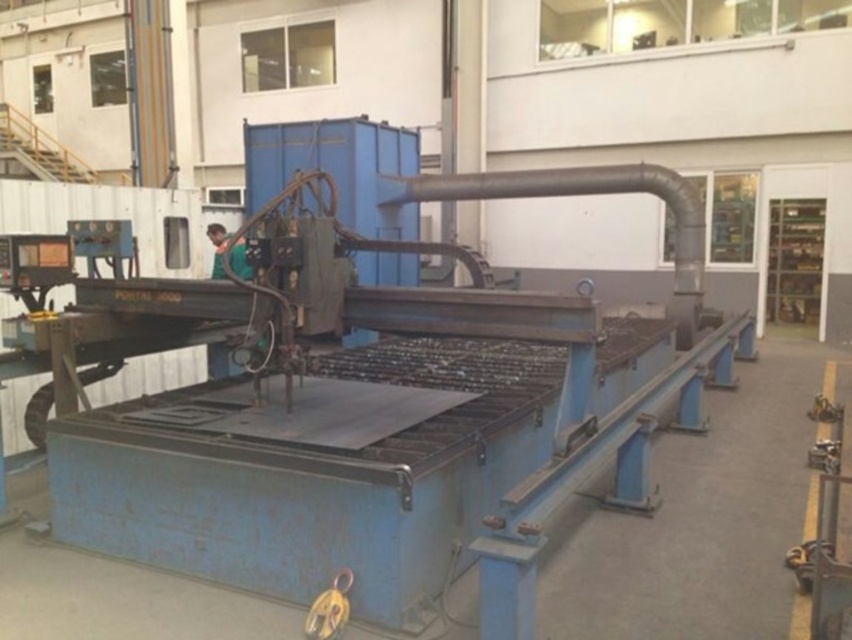
You are an inspector standing at the front of the CNC plasma cutter machine. You notice two points marked on the machine. Which of the two points, point (321, 608) or point (220, 260), is closer to your current position?

Point (321, 608) is closer to the camera than point (220, 260), so the point closer to your current position is point (321, 608).

You are an employee in the workshop and need to hang the green fabric shirt at center on the yellow metallic hook at lower center. Can you do this without needing a stool?

The yellow metallic hook at lower center has a lesser height compared to green fabric shirt at center, which means the hook is lower than the shirt. Since the hook is lower, you can easily hang the green fabric shirt at center on it without needing a stool.